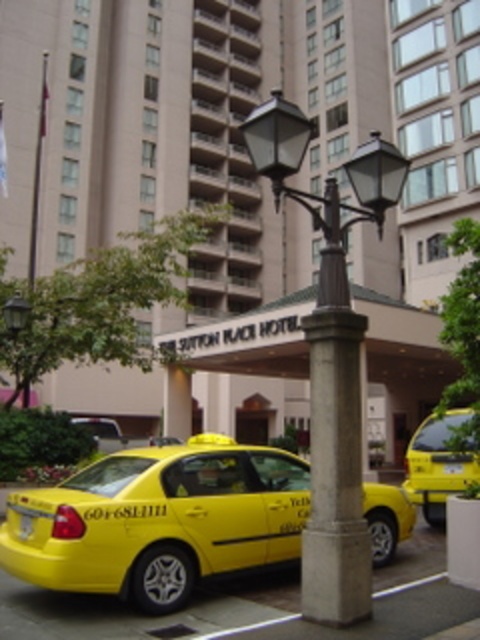
In the scene shown: You are a guest at The Sutton Place Hotel and need to hail a taxi. From your vantage point at the hotel entrance, which taxi is closer to you, the yellow plastic taxi cab at center or the yellow matte taxi cab at lower left?

The yellow plastic taxi cab at center is closer to you because it is positioned above the yellow matte taxi cab at lower left, indicating it is nearer in the visual plane.

Based on the photo, you are a delivery person who needs to park your 3.5 meter long van between the two yellow matte taxis. Can you fit your van between the yellow matte taxi at lower left and the yellow matte taxi cab at lower left?

The two yellow matte taxis are 7.28 meters apart, so yes, the van can fit between them since it is shorter than the distance between the two vehicles.

You are a delivery person with a cart that is 2 meters long. You need to move your cart between the yellow plastic taxi cab at center and the polished bronze streetlight at center. Is there enough space to maneuver your cart between them?

The yellow plastic taxi cab at center and the polished bronze streetlight at center are 15.29 meters apart from each other, so yes, there is enough space to maneuver a 2 meter long cart between them.